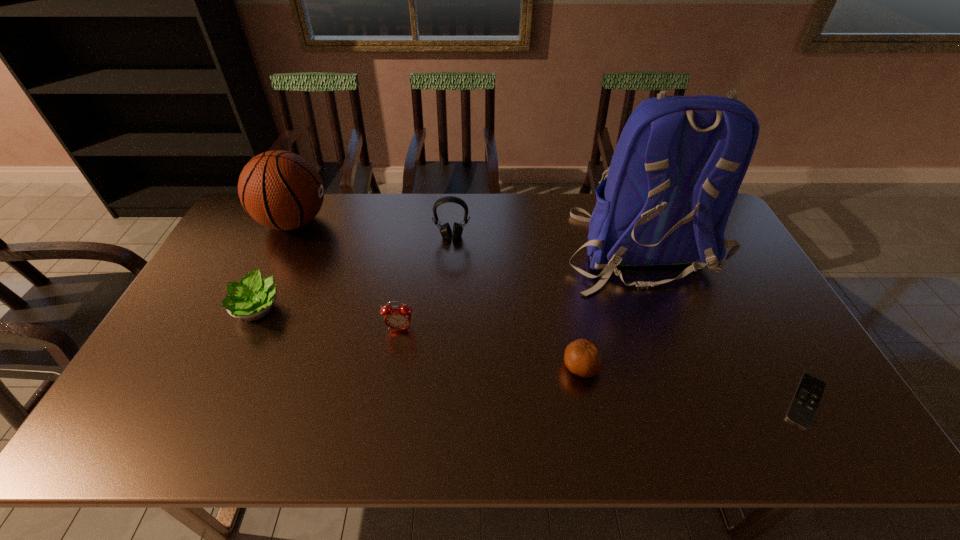
The width and height of the screenshot is (960, 540). Identify the location of vacant space located on the side where the inflation valve is located. pyautogui.click(x=407, y=222).

Find the location of a particular element. Image resolution: width=960 pixels, height=540 pixels. vacant area situated on the front-facing side of the fourth object from left to right is located at coordinates (447, 304).

Find the location of a particular element. This screenshot has height=540, width=960. blank space located on the face of the fourth shortest object is located at coordinates (382, 439).

Identify the location of free space located 0.180m on the back of the lettuce. (286, 247).

Locate an element on the screen. free location located on the front of the clementine is located at coordinates (590, 414).

Find the location of a particular element. This screenshot has height=540, width=960. vacant space positioned 0.310m on the back of the remote control is located at coordinates (739, 286).

At what (x,y) coordinates should I click in order to perform the action: click on backpack that is at the far edge. Please return your answer as a coordinate pair (x, y). The height and width of the screenshot is (540, 960). Looking at the image, I should click on (676, 170).

Where is `basketball that is at the far edge`? The width and height of the screenshot is (960, 540). basketball that is at the far edge is located at coordinates (281, 190).

You are a GUI agent. You are given a task and a screenshot of the screen. Output one action in this format:
    pyautogui.click(x=<x>, y=<y>)
    Task: Click on the headset situated at the far edge
    
    Given the screenshot: What is the action you would take?
    pyautogui.click(x=445, y=230)

I want to click on object that is at the near edge, so click(x=804, y=405).